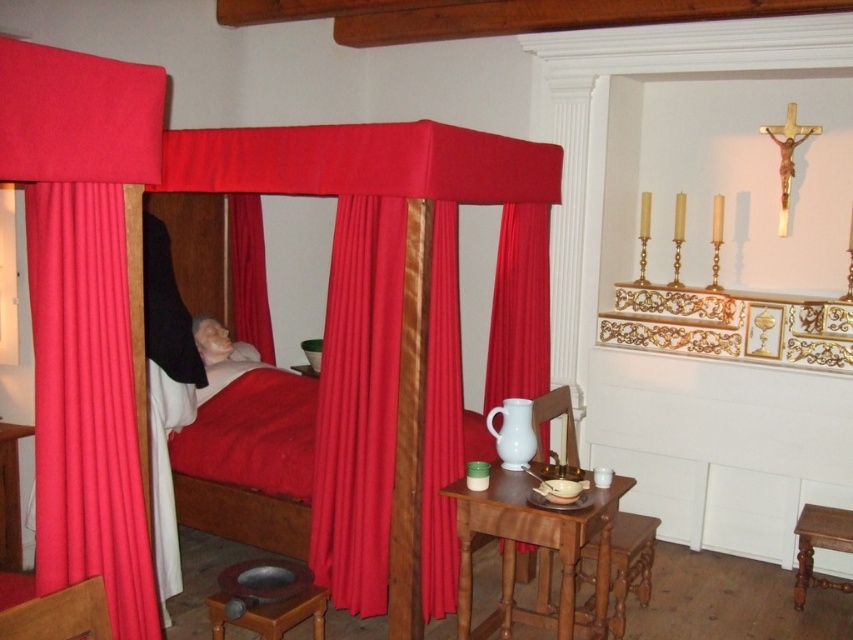
Question: Which object is farther from the camera taking this photo?

Choices:
 (A) velvet red curtain at center
 (B) matte red fabric canopy bed at center
 (C) wooden stool at lower left

Answer: (A)

Question: Does matte red curtain at left appear over wooden carved stool at lower center?

Choices:
 (A) no
 (B) yes

Answer: (B)

Question: Considering the real-world distances, which object is closest to the wooden table at lower left?

Choices:
 (A) wooden table at center
 (B) wooden stool at lower right

Answer: (A)

Question: Is matte red curtain at left closer to camera compared to wooden carved stool at lower center?

Choices:
 (A) no
 (B) yes

Answer: (B)

Question: Estimate the real-world distances between objects in this image. Which object is closer to the matte red fabric canopy bed at center?

Choices:
 (A) wooden stool at lower right
 (B) matte red curtain at left
 (C) velvet red curtain at center
 (D) red velvet curtain at center

Answer: (C)

Question: Is velvet red curtain at center further to camera compared to wooden carved stool at lower center?

Choices:
 (A) no
 (B) yes

Answer: (A)